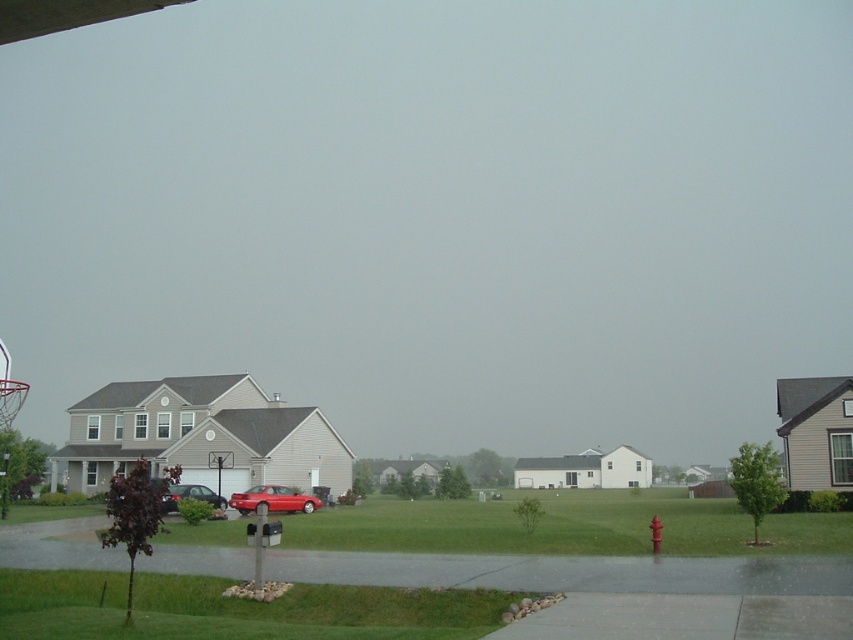
You are a delivery person trying to park your van in the driveway. The van is 2 meters wide. The driveway has the glossy red car at center and the metallic silver basketball hoop at center. Can you safely park your van without hitting the basketball hoop?

The glossy red car at center is positioned under the metallic silver basketball hoop at center. Since the car is under the hoop, the hoop is likely above the car, so parking the van there might hit the hoop. Therefore, you should not park the van there to avoid collision.

You are standing on the driveway and want to walk towards the house. Which object, the metallic silver basketball hoop at center or the red plastic fire hydrant at center, will you pass first?

You will pass the metallic silver basketball hoop at center first because it is closer to you than the red plastic fire hydrant at center, which is further away.